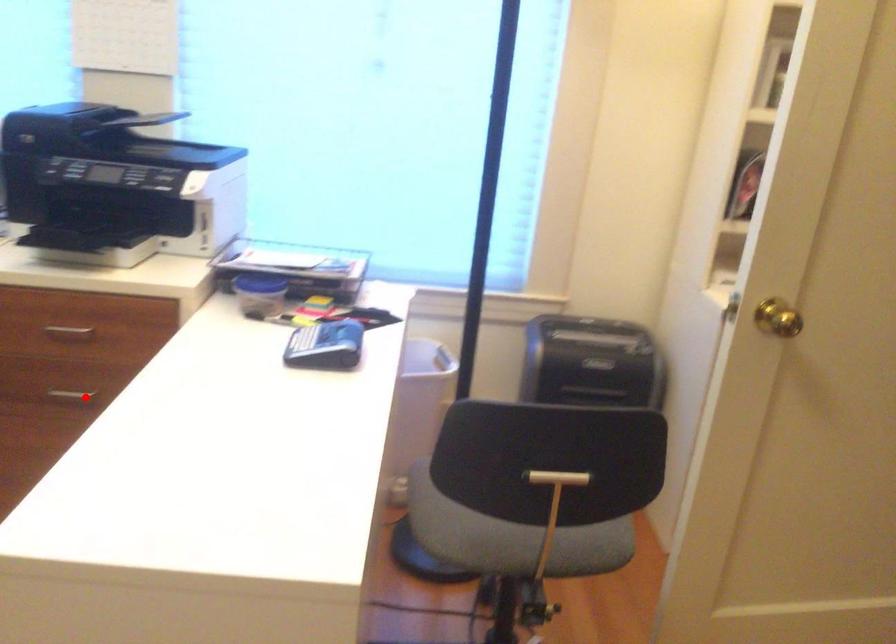
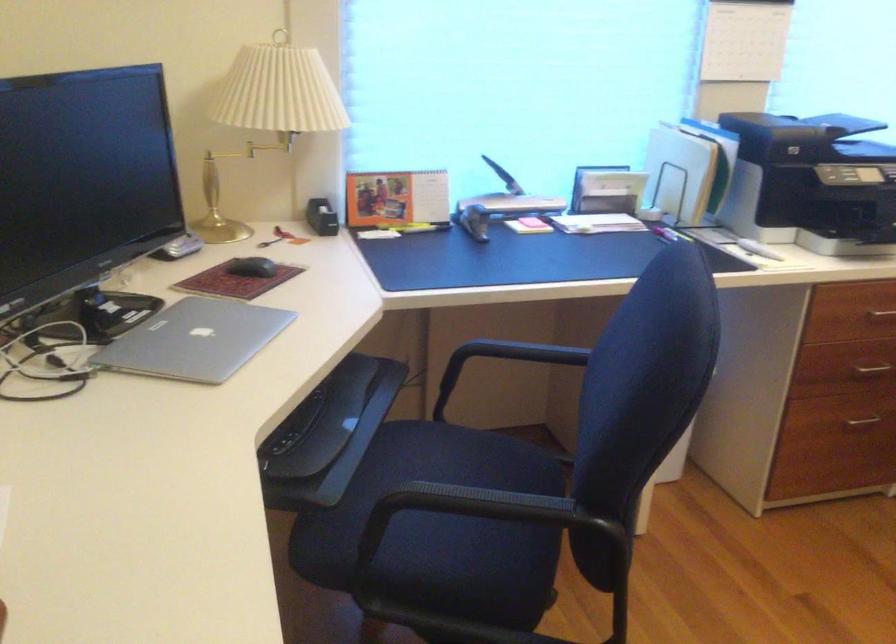
Where in the second image is the point corresponding to the highlighted location from the first image?

(869, 370)